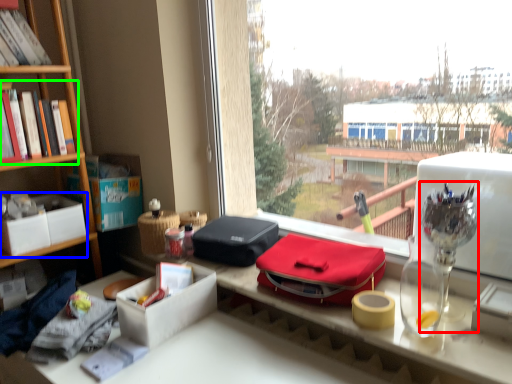
Question: Based on their relative distances, which object is farther from glass vase (highlighted by a red box)? Choose from box (highlighted by a blue box) and book (highlighted by a green box).

Choices:
 (A) box
 (B) book

Answer: (A)